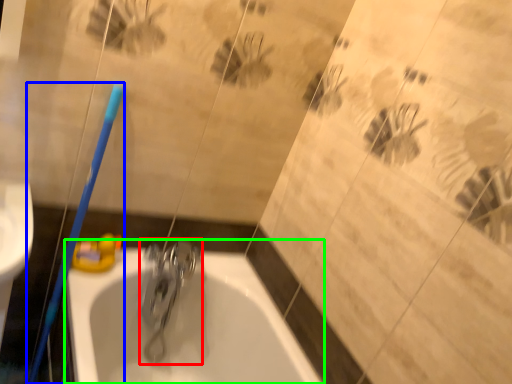
Question: Considering the real-world distances, which object is closest to tap (highlighted by a red box)? toothbrush (highlighted by a blue box) or bathtub (highlighted by a green box).

Choices:
 (A) toothbrush
 (B) bathtub

Answer: (B)